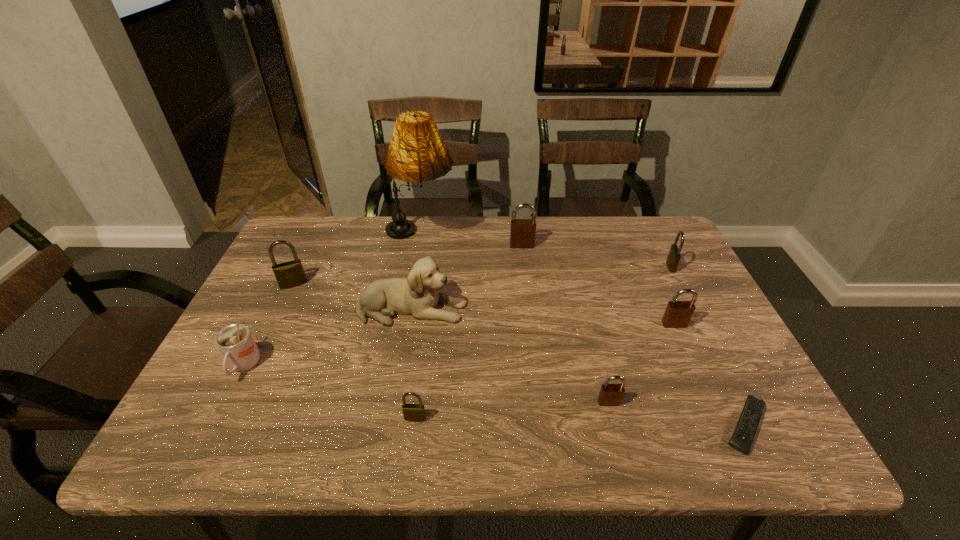
This screenshot has height=540, width=960. Identify the location of object that stands as the seventh closest to the third nearest padlock. (412, 412).

This screenshot has height=540, width=960. I want to click on the sixth closest object to the second nearest padlock, so click(522, 231).

What are the coordinates of `padlock that stands as the fifth closest to the leftmost brass padlock` in the screenshot? It's located at (674, 255).

Choose which padlock is the fourth nearest neighbor to the leftmost brown padlock. Please provide its 2D coordinates. Your answer should be formatted as a tuple, i.e. [(x, y)], where the tuple contains the x and y coordinates of a point satisfying the conditions above.

[(290, 274)]

Select which brass padlock appears as the third closest to the cup. Please provide its 2D coordinates. Your answer should be formatted as a tuple, i.e. [(x, y)], where the tuple contains the x and y coordinates of a point satisfying the conditions above.

[(674, 255)]

At what (x,y) coordinates should I click in order to perform the action: click on brass padlock object that ranks as the second closest to the lampshade. Please return your answer as a coordinate pair (x, y). Looking at the image, I should click on [x=412, y=412].

Where is `the closest brown padlock to the rightmost brown padlock`? the closest brown padlock to the rightmost brown padlock is located at coordinates (610, 394).

Where is `brown padlock that is the closest to the second brass padlock from right to left`? This screenshot has width=960, height=540. brown padlock that is the closest to the second brass padlock from right to left is located at coordinates (610, 394).

The image size is (960, 540). Find the location of `vacant area in the image that satisfies the following two spatial constraints: 1. on the front-facing side of the rightmost brown padlock; 2. on the left side of the remote control`. vacant area in the image that satisfies the following two spatial constraints: 1. on the front-facing side of the rightmost brown padlock; 2. on the left side of the remote control is located at coordinates (720, 425).

In order to click on free space that satisfies the following two spatial constraints: 1. on the back side of the shortest object; 2. on the front-facing side of the lampshade in this screenshot , I will do `click(651, 235)`.